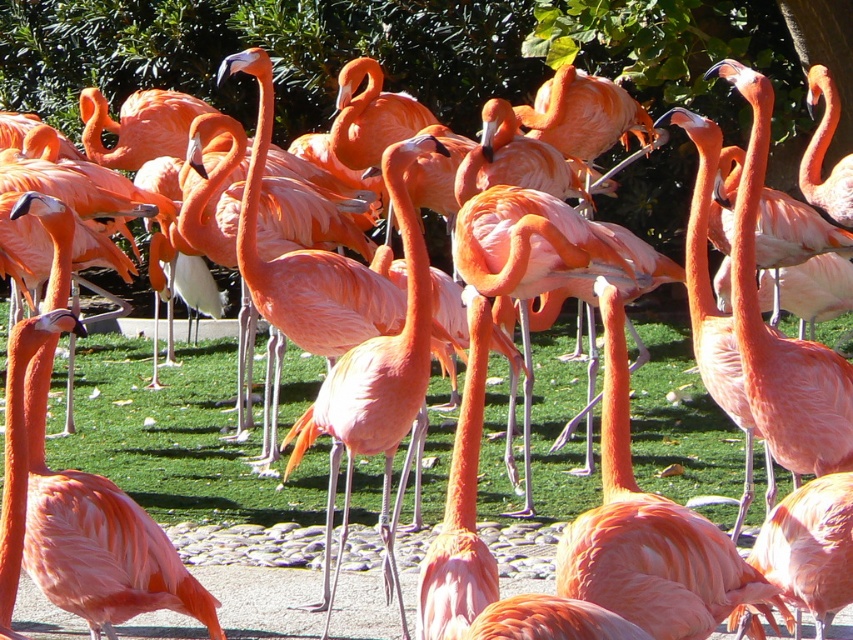
You are a zookeeper who needs to place a new flamingo statue in the enclosure. The statue is exactly the same size as the matte pink flamingo at center. Where should you place it so that it stands on the green grass at center?

You should place the new flamingo statue on the green grass at center because the green grass at center is positioned under the matte pink flamingo at center, meaning the existing flamingo is already standing on it. Since the statue is the same size, placing it there would ensure it also stands on the green grass at center.